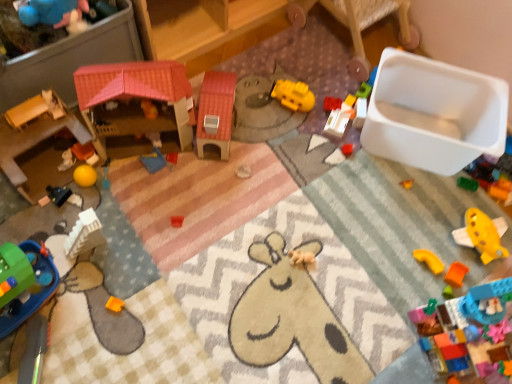
I want to click on free space to the left of white plastic container at upper right, the 1th furniture when ordered from right to left, so click(274, 55).